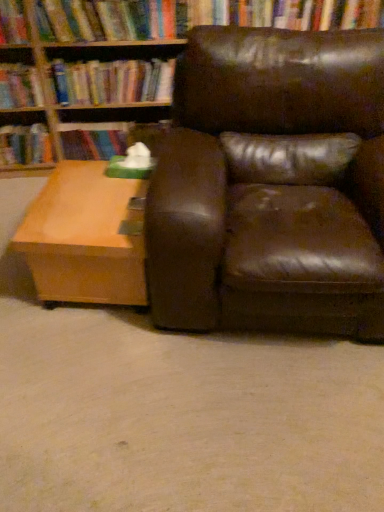
Where is `vacant area that is in front of light brown wood coffee table at lower left`? vacant area that is in front of light brown wood coffee table at lower left is located at coordinates point(95,360).